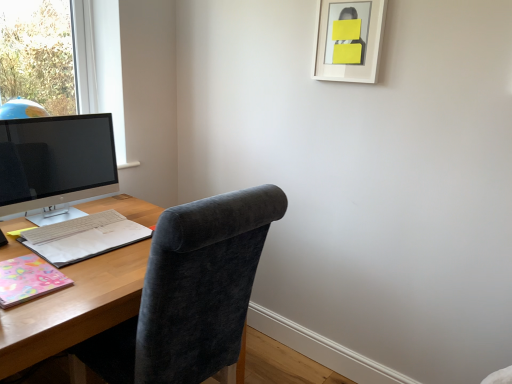
Question: In terms of height, does pastel floral paper at lower left, the first notebook from the front, look taller or shorter compared to multicolored paper notebook at left, acting as the first notebook starting from the back?

Choices:
 (A) tall
 (B) short

Answer: (B)

Question: Is pastel floral paper at lower left, which is the 2th notebook from back to front, bigger or smaller than multicolored paper notebook at left, acting as the first notebook starting from the back?

Choices:
 (A) big
 (B) small

Answer: (B)

Question: Estimate the real-world distances between objects in this image. Which object is closer to the white matte picture frame at upper right?

Choices:
 (A) satin black monitor at left
 (B) white matte keyboard at lower left
 (C) dark gray fabric chair at center
 (D) multicolored paper notebook at left, acting as the first notebook starting from the back
 (E) wooden desk at center

Answer: (C)

Question: Which is nearer to the white matte picture frame at upper right?

Choices:
 (A) satin black monitor at left
 (B) wooden desk at center
 (C) pastel floral paper at lower left, the first notebook from the front
 (D) dark gray fabric chair at center
 (E) multicolored paper notebook at left, acting as the second notebook starting from the front

Answer: (D)